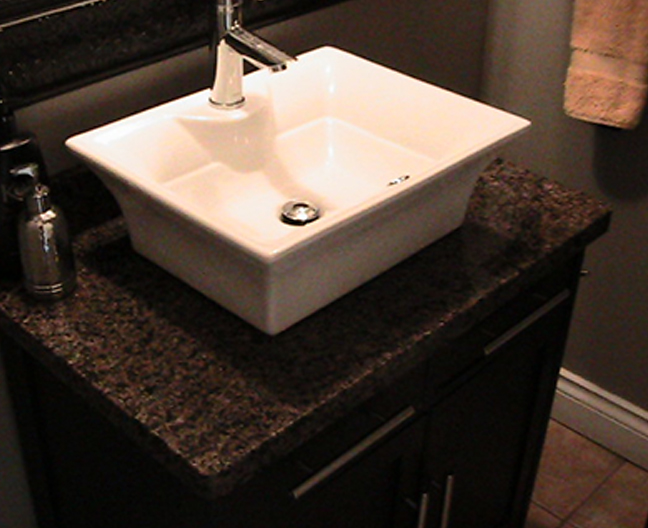
This screenshot has height=528, width=648. I want to click on grey wall, so click(x=522, y=47), click(x=391, y=41).